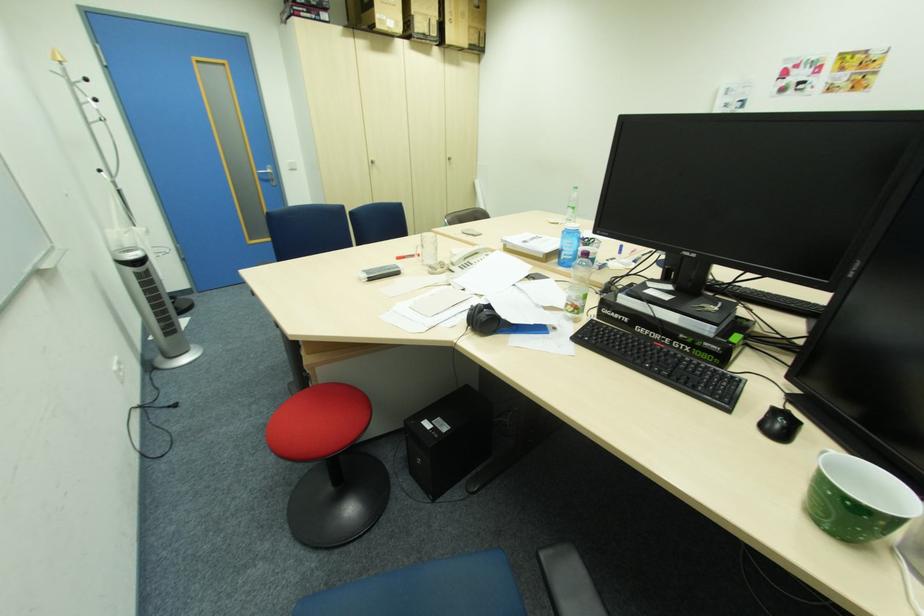
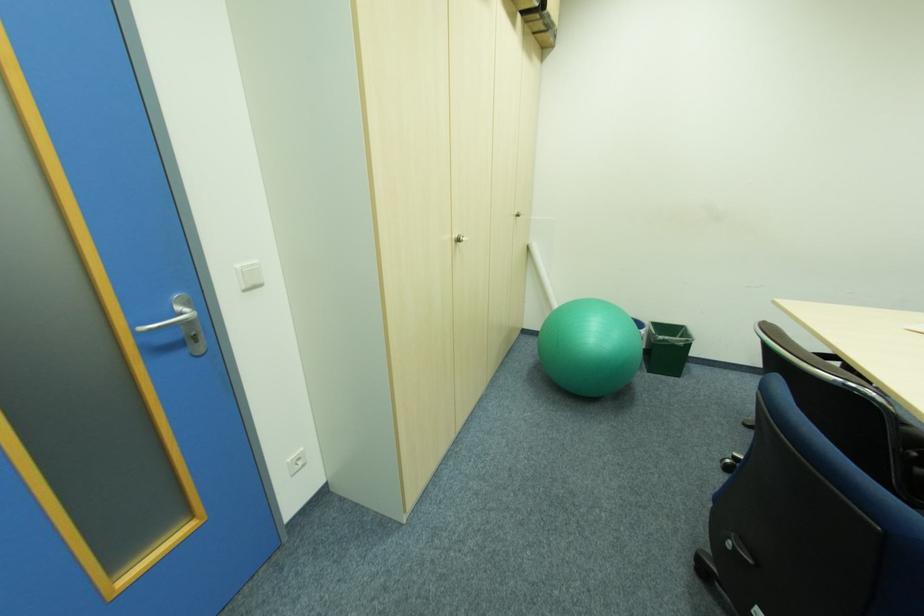
In the second image, find the point that corresponds to [280,180] in the first image.

(200, 339)